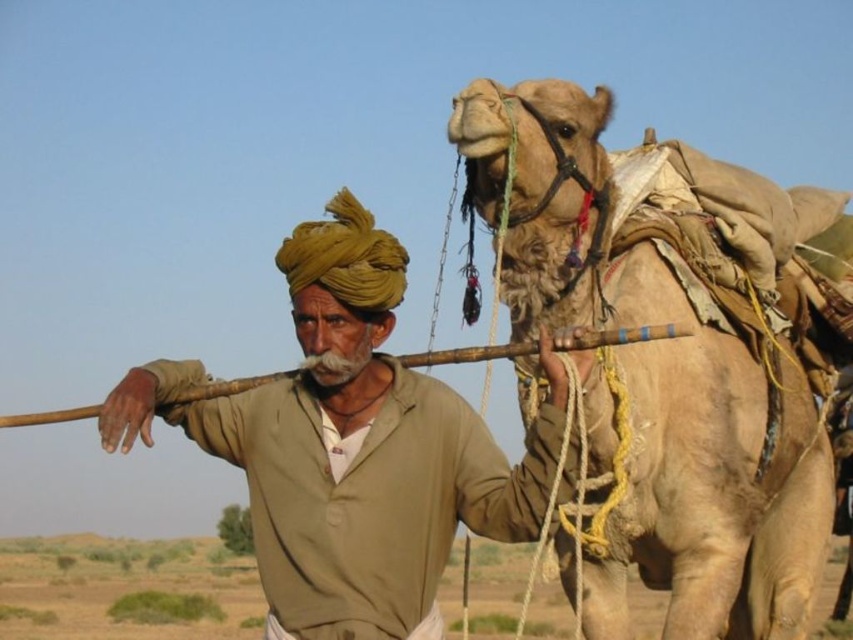
You are a traveler in the desert and see the fuzzy beige camel at right and the khaki cotton shirt at center. Which object is closer to you?

The fuzzy beige camel at right is closer to you because it is positioned over the khaki cotton shirt at center, indicating it is in front.

You are standing in the desert and see a man and a camel. The man is holding a wooden stick. There is a point at coordinates (x=670, y=355). Can you tell me what object this point is on?

The point at coordinates (x=670, y=355) is on the fuzzy beige camel at right.

You are a traveler in the desert and need to decide which item is larger between the fuzzy beige camel at right and the khaki cotton shirt at center. Which one should you choose?

The fuzzy beige camel at right is bigger than the khaki cotton shirt at center, so you should choose the fuzzy beige camel at right.